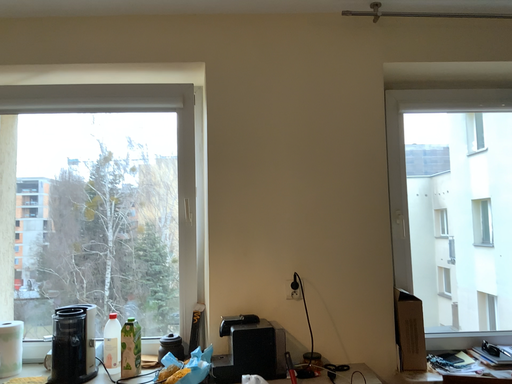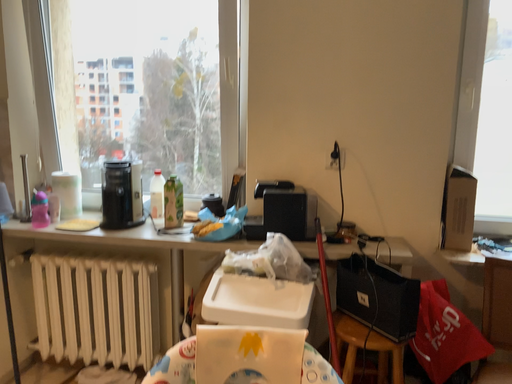
Question: How did the camera likely rotate when shooting the video?

Choices:
 (A) rotated downward
 (B) rotated upward

Answer: (A)